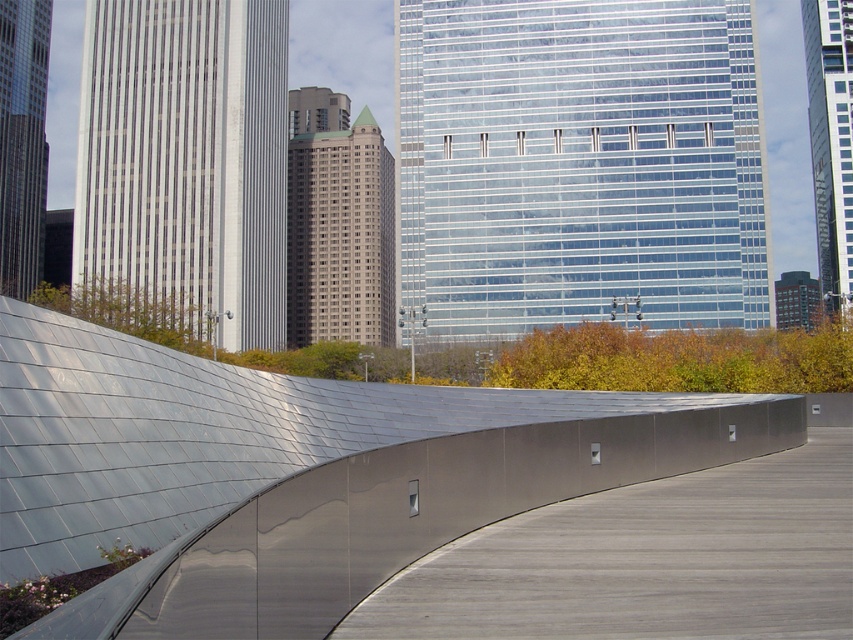
You are an architect evaluating the urban landscape. You need to determine the spatial relationship between the silver metallic ramp at center and the satin silver wall at center. Which object is positioned higher in the scene?

The silver metallic ramp at center is located above the satin silver wall at center, so it is positioned higher in the scene.

You are a delivery robot with a 2.5 meter wide package. You need to navigate through the space between the silver metallic ramp at center and the nearest building. Can you fit through the space?

The space between the silver metallic ramp at center and the nearest building is 3.27 meters. Since your package is 2.5 meters wide, you can fit through the space as it is wider than the package.

You are standing at the point marked by coordinates (294,474) in the urban landscape. What object are you directly positioned on?

You are directly positioned on the silver metallic ramp at center located at point (294,474).